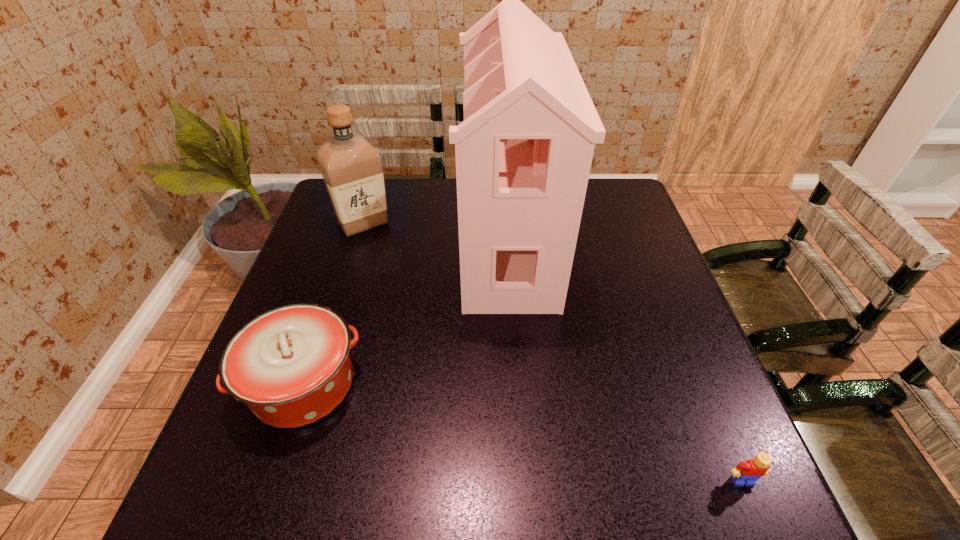
This screenshot has height=540, width=960. I want to click on the tallest object, so click(523, 153).

At what (x,y) coordinates should I click in order to perform the action: click on the second object from right to left. Please return your answer as a coordinate pair (x, y). The image size is (960, 540). Looking at the image, I should click on (523, 153).

I want to click on the third shortest object, so pos(351,167).

You are a GUI agent. You are given a task and a screenshot of the screen. Output one action in this format:
    pyautogui.click(x=<x>, y=<y>)
    Task: Click on the second shortest object
    This screenshot has height=540, width=960.
    Given the screenshot: What is the action you would take?
    pyautogui.click(x=291, y=365)

Find the location of `the third farthest object`. the third farthest object is located at coordinates click(x=291, y=365).

Find the location of a particular element. This screenshot has width=960, height=540. the nearest object is located at coordinates (746, 473).

Identify the location of the rightmost object. (746, 473).

Image resolution: width=960 pixels, height=540 pixels. What are the coordinates of `vacant space located 0.090m on the front-facing side of the third object from left to right` in the screenshot? It's located at pyautogui.click(x=430, y=240).

Locate an element on the screen. Image resolution: width=960 pixels, height=540 pixels. free location located on the front-facing side of the third object from left to right is located at coordinates (373, 240).

Where is `blank space located 0.390m on the front-facing side of the third object from left to right`? blank space located 0.390m on the front-facing side of the third object from left to right is located at coordinates (324, 240).